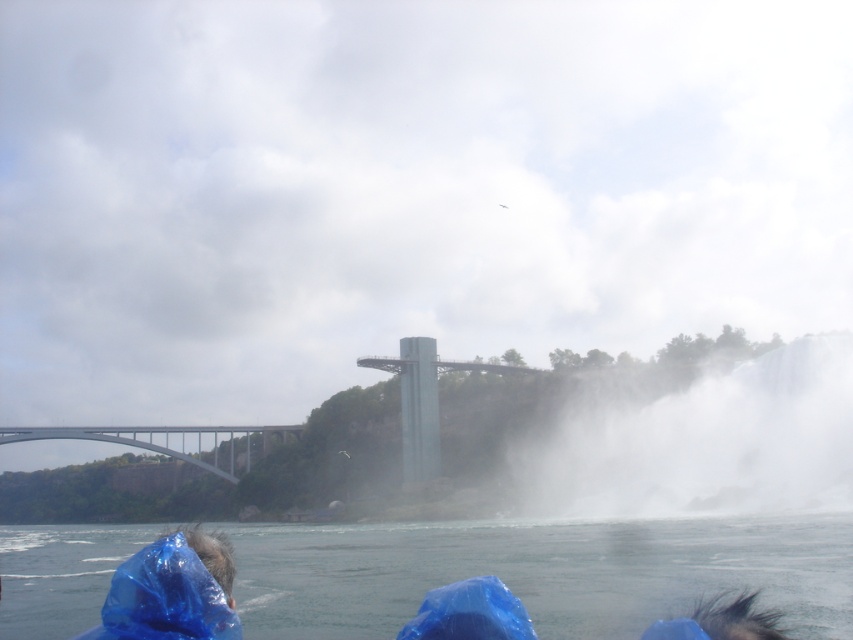
You are standing at the base of Niagara Falls and want to reach the point marked at coordinates (299, 560). Given that the distance between you and this point is 105.19 meters, can you estimate how long it would take to walk there at a normal pace?

The distance between you and the point marked at coordinates (299, 560) is 105.19 meters. At a normal walking pace of approximately 1.4 meters per second, it would take roughly 75 seconds, or about 1 minute and 15 seconds, to reach the point.

You are a photographer planning to capture the view of the white mist at lower right and the concrete bridge at lower left in a single shot. Considering their widths, which object would require you to adjust your camera angle more to ensure both are fully in frame?

The concrete bridge at lower left requires adjusting the camera angle more because it is wider than the white mist at lower right, which is narrower. To include both in the frame, you need to account for the wider bridge.